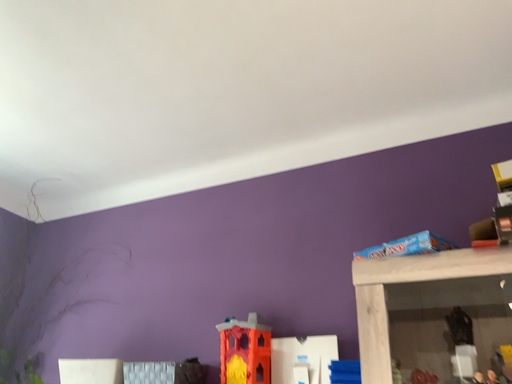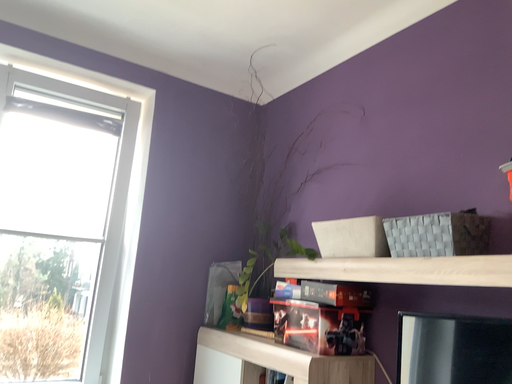
Question: How did the camera likely rotate when shooting the video?

Choices:
 (A) rotated downward
 (B) rotated upward

Answer: (A)